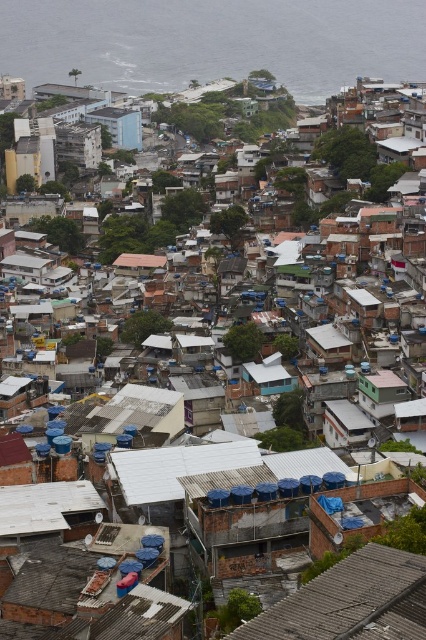
Question: Is blue water at upper center positioned in front of rusty corrugated metal roof at center?

Choices:
 (A) no
 (B) yes

Answer: (A)

Question: Where is blue water at upper center located in relation to rusty corrugated metal roof at center in the image?

Choices:
 (A) left
 (B) right

Answer: (A)

Question: Which of these objects is positioned farthest from the blue water at upper center?

Choices:
 (A) light blue concrete building at upper center
 (B) rusty corrugated metal roof at center

Answer: (B)

Question: Which of the following is the closest to the observer?

Choices:
 (A) (134, 131)
 (B) (359, 586)

Answer: (B)

Question: Is blue water at upper center to the left of light blue concrete building at upper center from the viewer's perspective?

Choices:
 (A) yes
 (B) no

Answer: (B)

Question: Estimate the real-world distances between objects in this image. Which object is farther from the light blue concrete building at upper center?

Choices:
 (A) rusty corrugated metal roof at center
 (B) blue water at upper center

Answer: (A)